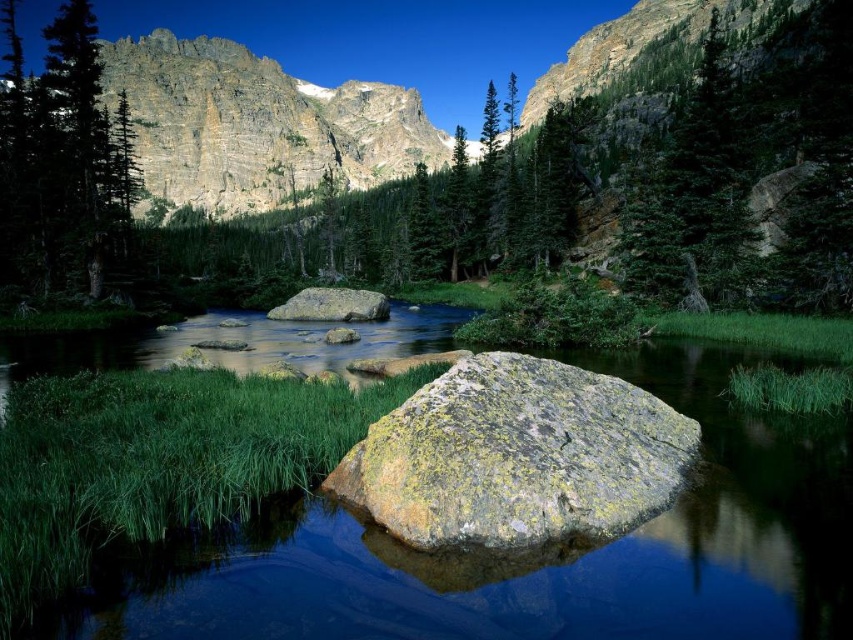
You are a hiker standing at the center of the image. You want to take a photo of the green matte tree at left. Which direction should you turn to face the tree?

The green matte tree at left is located at point (62, 164), which is to the left side of the image. Therefore, you should turn to your left to face the tree.